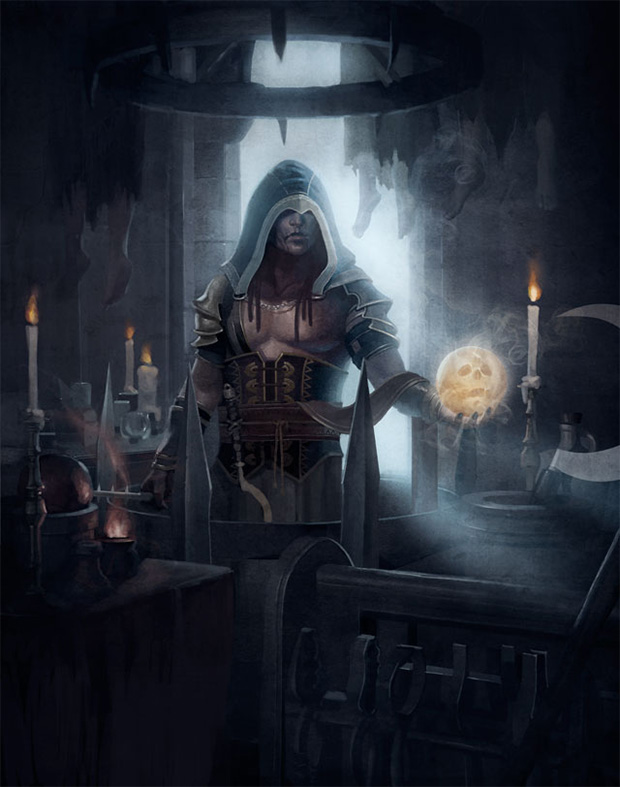
You are a GUI agent. You are given a task and a screenshot of the screen. Output one action in this format:
    pyautogui.click(x=<x>, y=<y>)
    Task: Click on the floor
    This screenshot has width=620, height=787.
    Given the screenshot: What is the action you would take?
    pyautogui.click(x=301, y=710)